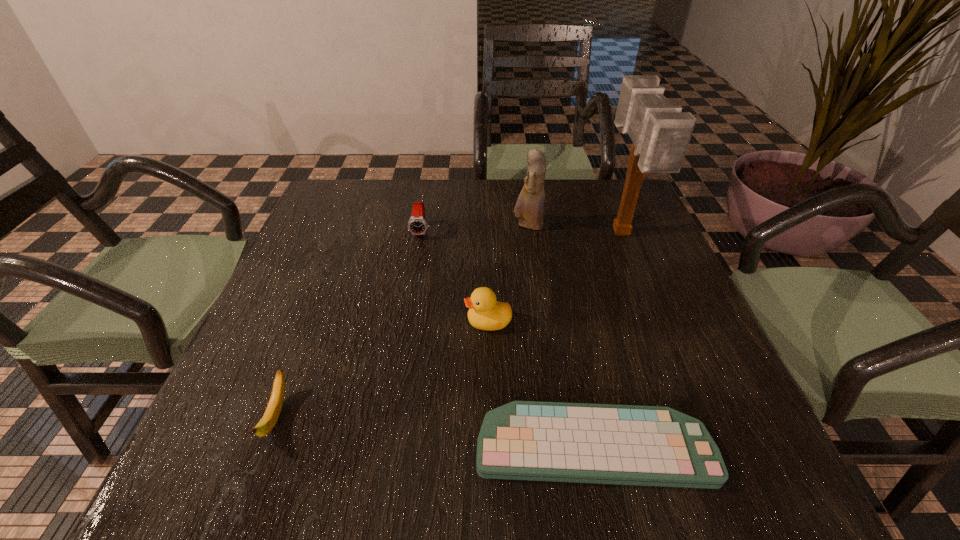
Image resolution: width=960 pixels, height=540 pixels. I want to click on the tallest object, so click(660, 132).

This screenshot has height=540, width=960. Identify the location of figurine. (530, 204).

Find the location of a particular element. The width and height of the screenshot is (960, 540). duck is located at coordinates (484, 313).

Locate an element on the screen. The width and height of the screenshot is (960, 540). watch is located at coordinates (417, 225).

The image size is (960, 540). I want to click on the fifth tallest object, so point(266,424).

Identify the location of the leftmost object. (266, 424).

You are a GUI agent. You are given a task and a screenshot of the screen. Output one action in this format:
    pyautogui.click(x=<x>, y=<y>)
    Task: Click on the computer keyboard
    
    Given the screenshot: What is the action you would take?
    523,440

I want to click on blank area located on the left of the mallet, so click(538, 234).

At what (x,y) coordinates should I click in order to perform the action: click on vacant point located 0.340m on the front-facing side of the figurine. Please return your answer as a coordinate pair (x, y). The width and height of the screenshot is (960, 540). Looking at the image, I should click on (385, 226).

Locate an element on the screen. Image resolution: width=960 pixels, height=540 pixels. vacant area located 0.110m on the front-facing side of the figurine is located at coordinates (471, 226).